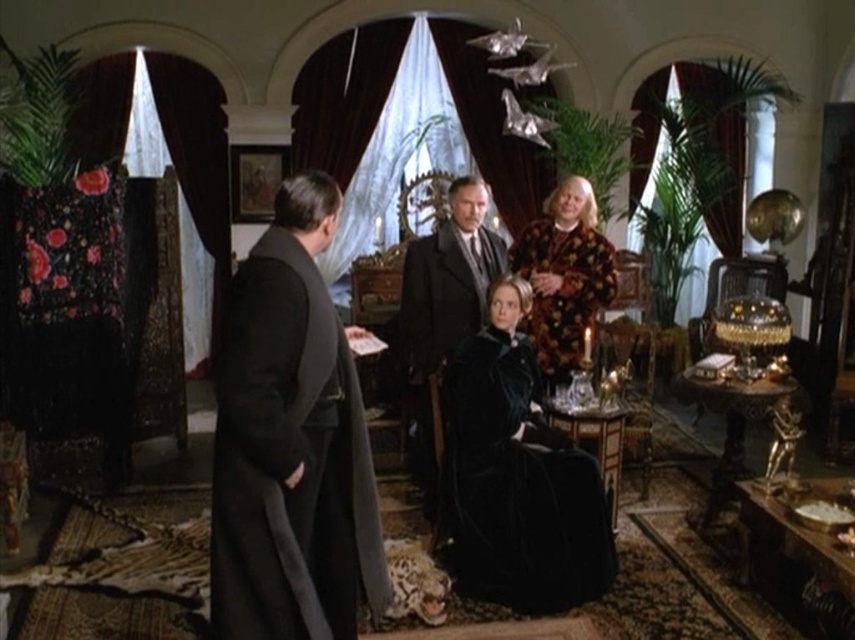
Who is more forward, (317,372) or (596,218)?

Point (317,372) is in front.

How distant is velvet robe at center from fluffy brown coat at center?

7.16 feet

This screenshot has width=855, height=640. I want to click on velvet robe at center, so click(292, 442).

Is velvet robe at center to the left of velvet black robe at left from the viewer's perspective?

Incorrect, velvet robe at center is not on the left side of velvet black robe at left.

Is velvet robe at center bigger than velvet black robe at left?

Yes.

Identify the location of velvet robe at center. (292, 442).

Find the location of a particular element. velvet robe at center is located at coordinates (292, 442).

Is velvet robe at center behind velvet black coat at center?

No, velvet robe at center is closer to the viewer.

Is point (254, 492) farther from camera compared to point (464, 282)?

No, (254, 492) is closer to viewer.

Identify the location of velvet robe at center. (292, 442).